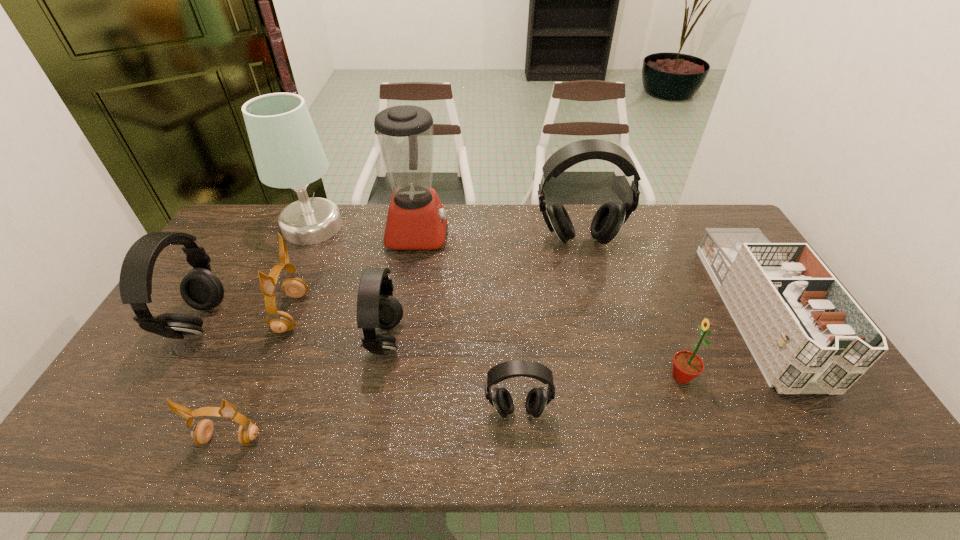
At what (x,y) coordinates should I click in order to perform the action: click on free space located on the ear cups of the second black earphone from left to right. Please return your answer as a coordinate pair (x, y). This screenshot has height=540, width=960. Looking at the image, I should click on (529, 341).

The width and height of the screenshot is (960, 540). Find the location of `vacant space situated 0.080m on the face of the green sunflower`. vacant space situated 0.080m on the face of the green sunflower is located at coordinates (636, 377).

This screenshot has height=540, width=960. What are the coordinates of `free spot located on the face of the green sunflower` in the screenshot? It's located at (540, 377).

Find the location of `vacant area located 0.350m on the face of the green sunflower`. vacant area located 0.350m on the face of the green sunflower is located at coordinates (531, 377).

Find the location of a particular element. This screenshot has height=540, width=960. free location located at the entrance of the dollhouse is located at coordinates (820, 417).

Where is `blank space located 0.050m on the ear cups of the nearest black earphone`? This screenshot has height=540, width=960. blank space located 0.050m on the ear cups of the nearest black earphone is located at coordinates (519, 444).

Image resolution: width=960 pixels, height=540 pixels. In order to click on blender that is positioned at the far edge in this screenshot , I will do `click(416, 220)`.

Identify the location of lampshade located at the far edge. (287, 151).

I want to click on earphone situated at the far edge, so click(x=608, y=220).

Image resolution: width=960 pixels, height=540 pixels. In order to click on object that is at the left edge in this screenshot , I will do `click(201, 289)`.